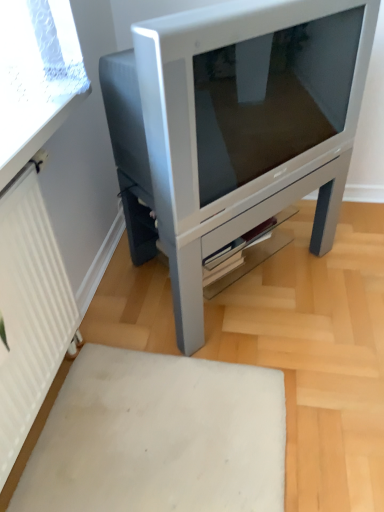
At what (x,y) coordinates should I click in order to perform the action: click on free space to the right of satin silver television at center. Please return your answer as a coordinate pair (x, y). Image resolution: width=384 pixels, height=512 pixels. Looking at the image, I should click on (338, 264).